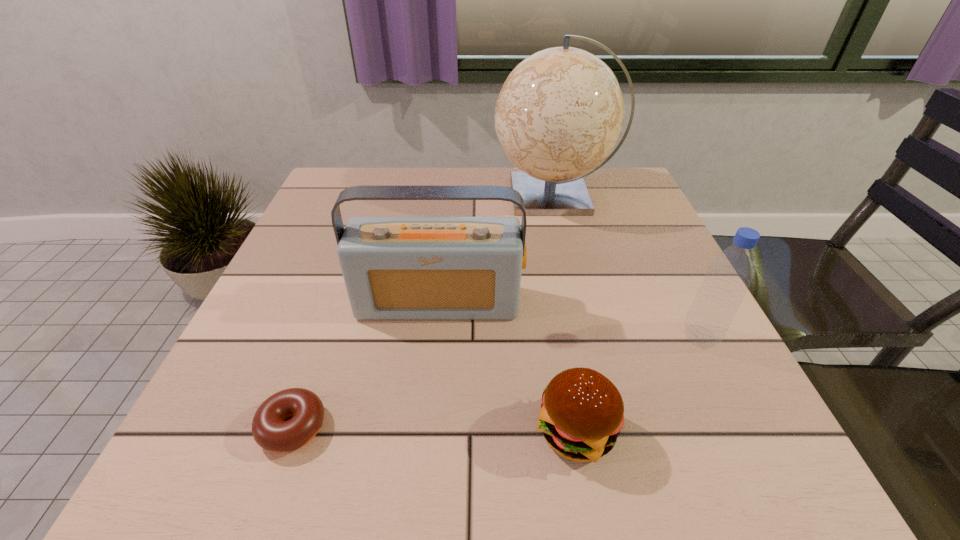
Where is `the tallest object`? This screenshot has width=960, height=540. the tallest object is located at coordinates (560, 112).

This screenshot has height=540, width=960. Find the location of `the farthest object`. the farthest object is located at coordinates (560, 112).

This screenshot has width=960, height=540. Identify the location of radio receiver. coord(395,268).

Find the location of a particular element. bottle is located at coordinates (729, 275).

Where is `hamburger`? hamburger is located at coordinates (582, 413).

Where is `doughnut`? The image size is (960, 540). doughnut is located at coordinates (271, 431).

Identify the location of free space located on the surface of the farthest object showing Europe and Africa. The height and width of the screenshot is (540, 960). (419, 195).

Locate an element on the screen. This screenshot has height=540, width=960. vacant space located 0.130m on the surface of the farthest object showing Europe and Africa is located at coordinates (444, 195).

Find the location of a particular element. The width and height of the screenshot is (960, 540). vacant region located 0.270m on the surface of the farthest object showing Europe and Africa is located at coordinates (393, 195).

Locate an element on the screen. free space located on the front-facing side of the radio receiver is located at coordinates (427, 410).